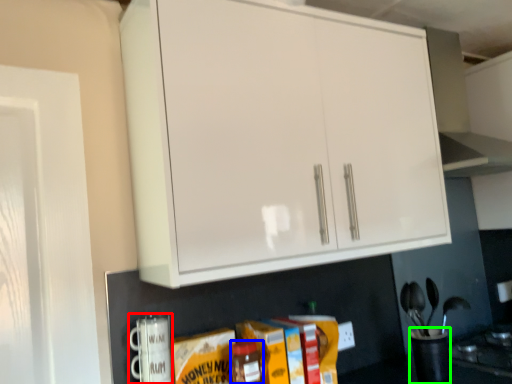
Question: Considering the real-world distances, which object is closest to appliance (highlighted by a red box)? bottle (highlighted by a blue box) or appliance (highlighted by a green box).

Choices:
 (A) bottle
 (B) appliance

Answer: (A)